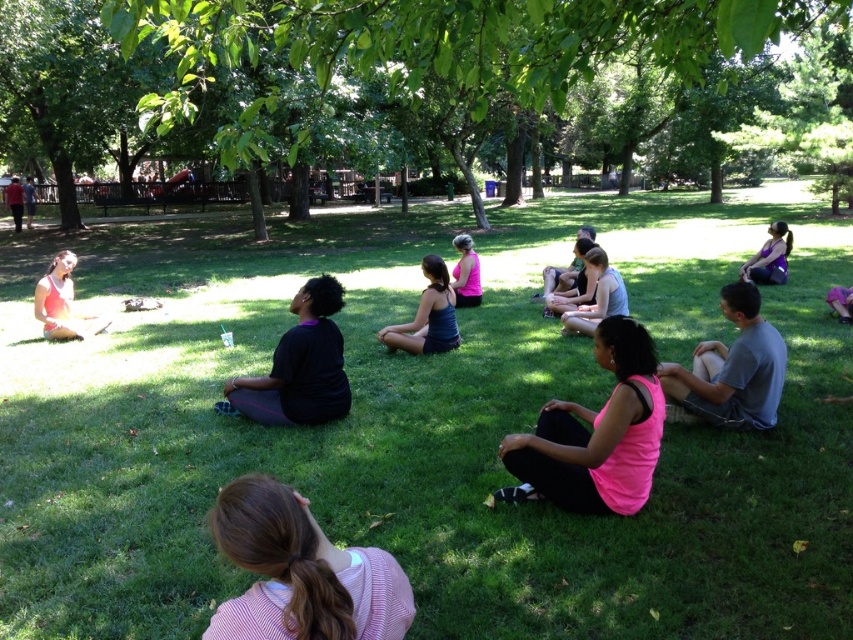
You are organizing a group activity and need to ensure everyone has enough space. Considering the gray cotton shirt at lower right and the matte black tank top at center, which clothing item takes up more space in the seating area?

The gray cotton shirt at lower right has a larger size compared to the matte black tank top at center, so it takes up more space in the seating area.

You are a photographer trying to capture a closeup of the pink fabric ponytail at lower center without including the green grass at center in the background. Based on their positions, is this possible?

The green grass at center is above the pink fabric ponytail at lower center, so if you position your camera below the ponytail and aim upwards, you can avoid capturing the green grass at center in the background.